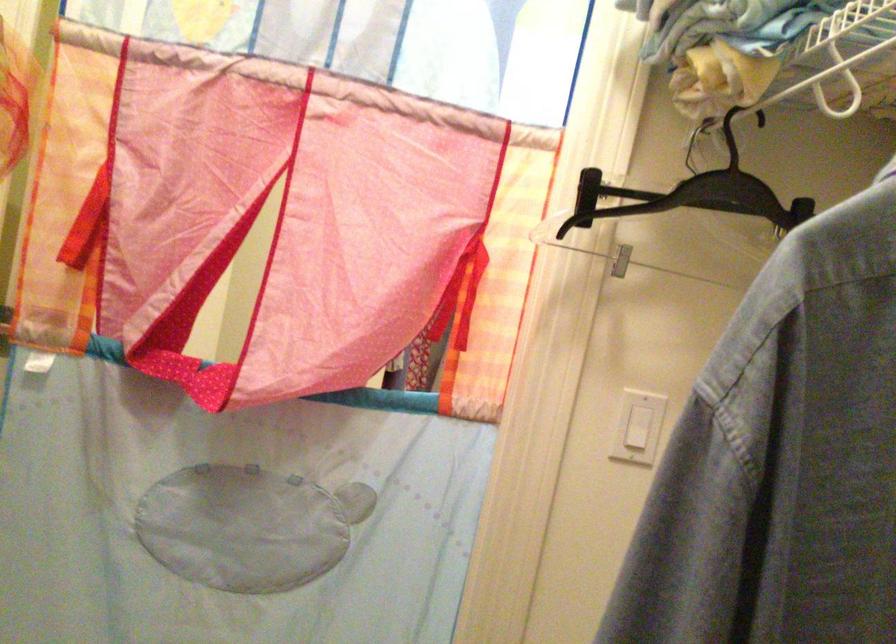
At what (x,y) coordinates should I click in order to perform the action: click on hanger clip. Please return your answer as a coordinate pair (x, y). The width and height of the screenshot is (896, 644). Looking at the image, I should click on (622, 261).